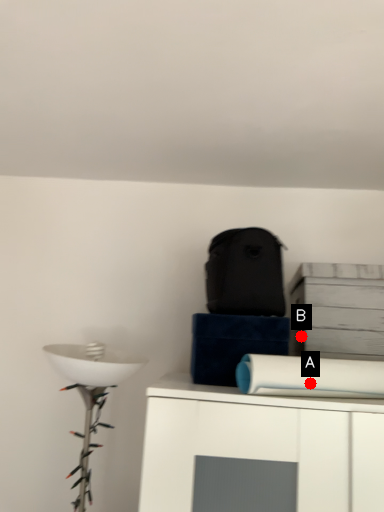
Question: Two points are circled on the image, labeled by A and B beside each circle. Among these points, which one is nearest to the camera?

Choices:
 (A) A is closer
 (B) B is closer

Answer: (A)